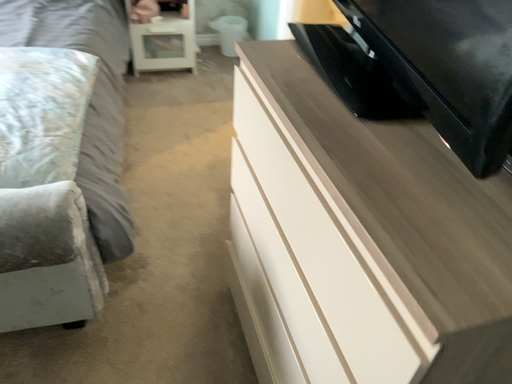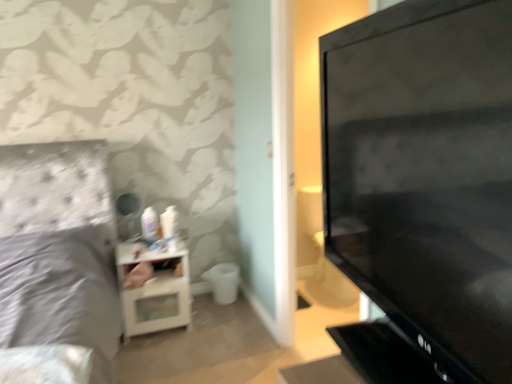
Question: How did the camera likely rotate when shooting the video?

Choices:
 (A) rotated upward
 (B) rotated downward

Answer: (A)